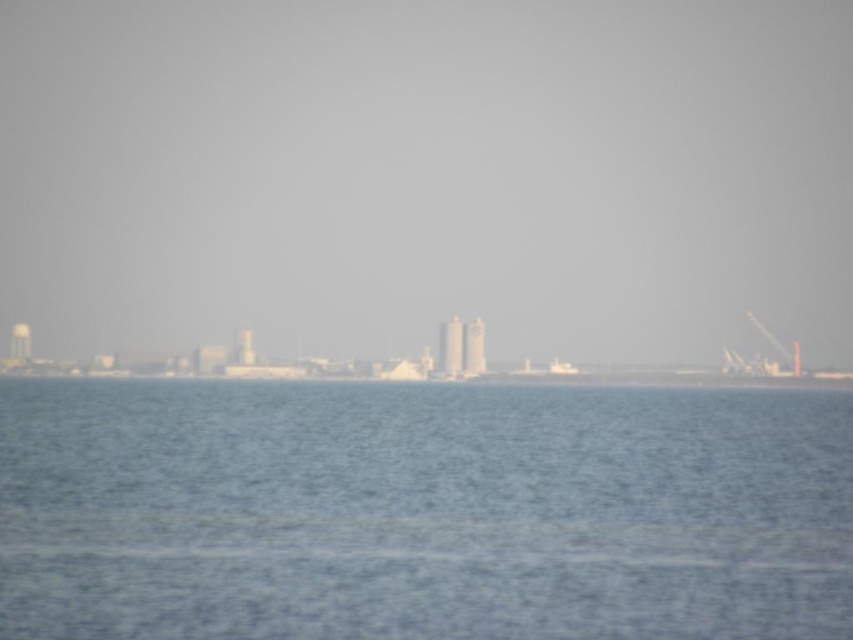
Question: Can you confirm if transparent glass skyscraper at center is positioned to the right of blue water at center?

Choices:
 (A) yes
 (B) no

Answer: (B)

Question: Which point is farther to the camera?

Choices:
 (A) blue water at center
 (B) transparent glass skyscraper at center

Answer: (B)

Question: Can you confirm if transparent glass skyscraper at center is positioned above blue water at center?

Choices:
 (A) yes
 (B) no

Answer: (A)

Question: Is transparent glass skyscraper at center closer to camera compared to blue water at center?

Choices:
 (A) yes
 (B) no

Answer: (B)